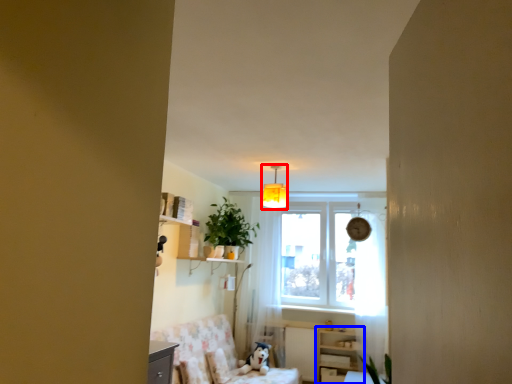
Question: Which of the following is the farthest to the observer, light fixture (highlighted by a red box) or dresser (highlighted by a blue box)?

Choices:
 (A) light fixture
 (B) dresser

Answer: (B)